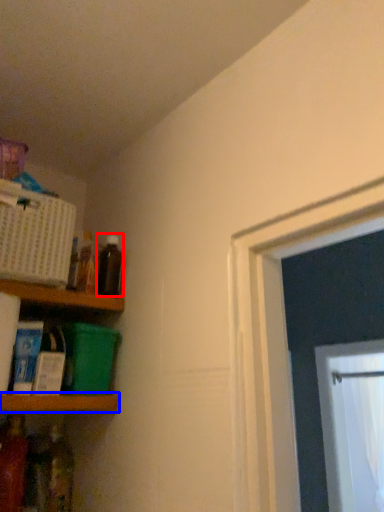
Question: Which point is closer to the camera, bottle (highlighted by a red box) or shelf (highlighted by a blue box)?

Choices:
 (A) bottle
 (B) shelf

Answer: (B)